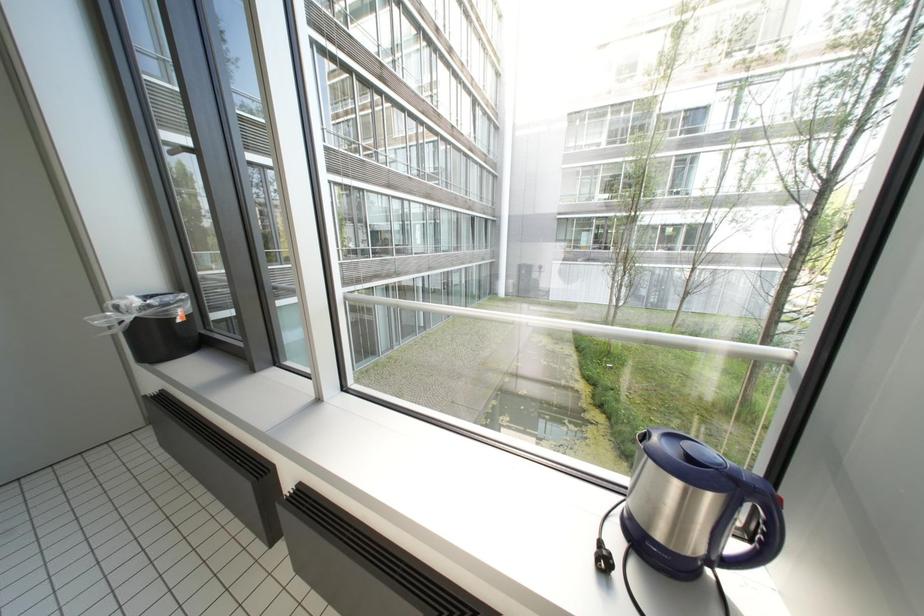
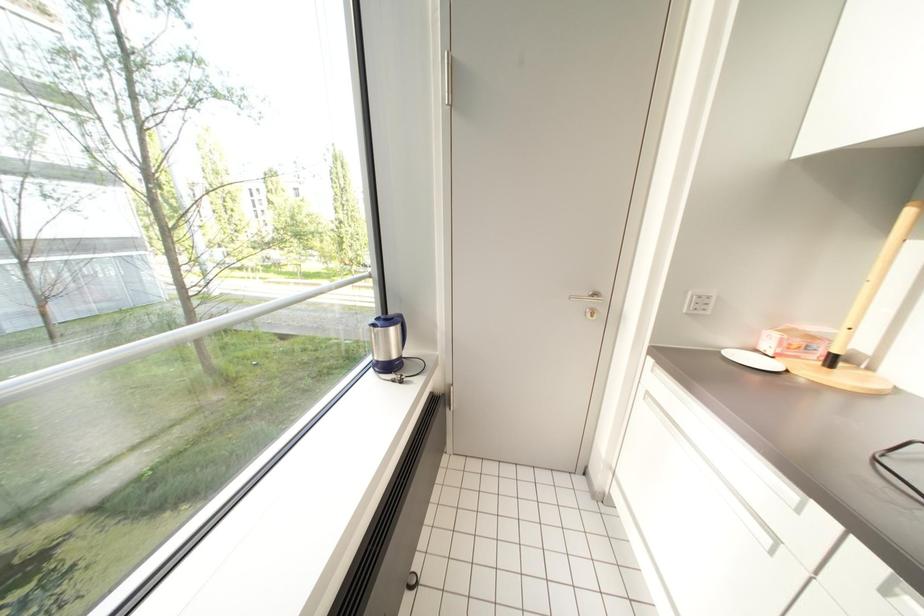
The first image is from the beginning of the video and the second image is from the end. How did the camera likely rotate when shooting the video?

The rotation direction of the camera is right-down.